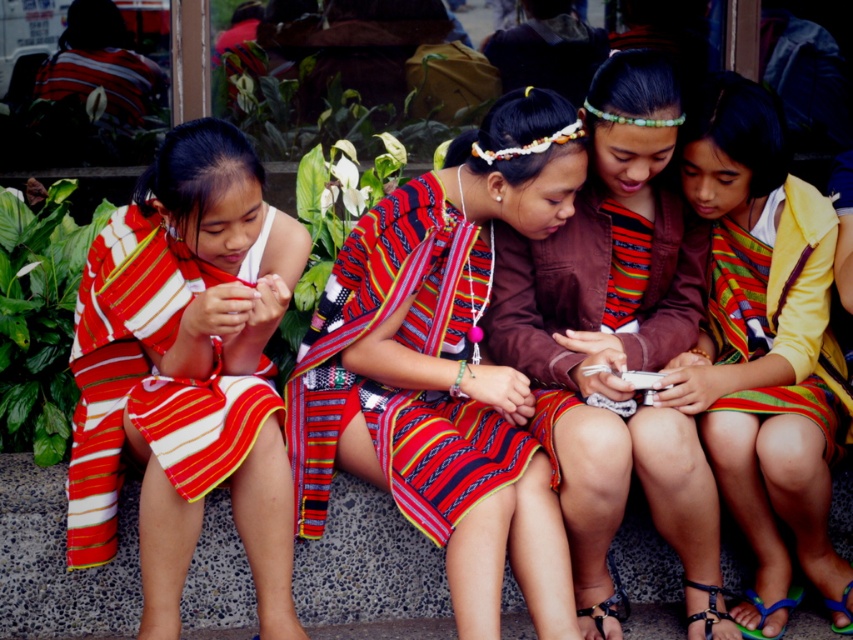
Question: Which of the following is the farthest from the observer?

Choices:
 (A) (563, 168)
 (B) (703, 586)

Answer: (B)

Question: Can you confirm if textured woven dress at center is thinner than blue rubber sandal at lower right?

Choices:
 (A) no
 (B) yes

Answer: (A)

Question: Is striped fabric dress at center closer to camera compared to black leather sandal at lower center?

Choices:
 (A) no
 (B) yes

Answer: (B)

Question: Does textured woven dress at center come behind striped cotton dress at right?

Choices:
 (A) yes
 (B) no

Answer: (B)

Question: Which object is the farthest from the blue rubber sandal at lower right?

Choices:
 (A) blue plastic sandal at lower right
 (B) matte brown jacket at center
 (C) textured woven dress at center

Answer: (C)

Question: Which point is farther to the camera?

Choices:
 (A) (419, 301)
 (B) (709, 604)

Answer: (A)